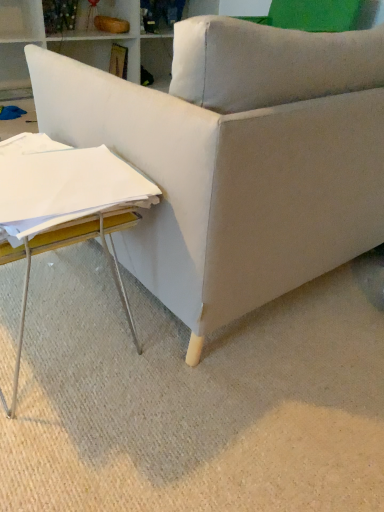
Question: Considering the positions of white wood table at lower left and beige fabric couch at lower right in the image, is white wood table at lower left bigger or smaller than beige fabric couch at lower right?

Choices:
 (A) small
 (B) big

Answer: (A)

Question: From a real-world perspective, is white wood table at lower left physically located above or below beige fabric couch at lower right?

Choices:
 (A) below
 (B) above

Answer: (B)

Question: Which is nearer to the beige fabric couch at lower right?

Choices:
 (A) white paper at lower left
 (B) white wood table at lower left

Answer: (B)

Question: Estimate the real-world distances between objects in this image. Which object is closer to the beige fabric couch at lower right?

Choices:
 (A) white wood table at lower left
 (B) white paper at lower left

Answer: (A)